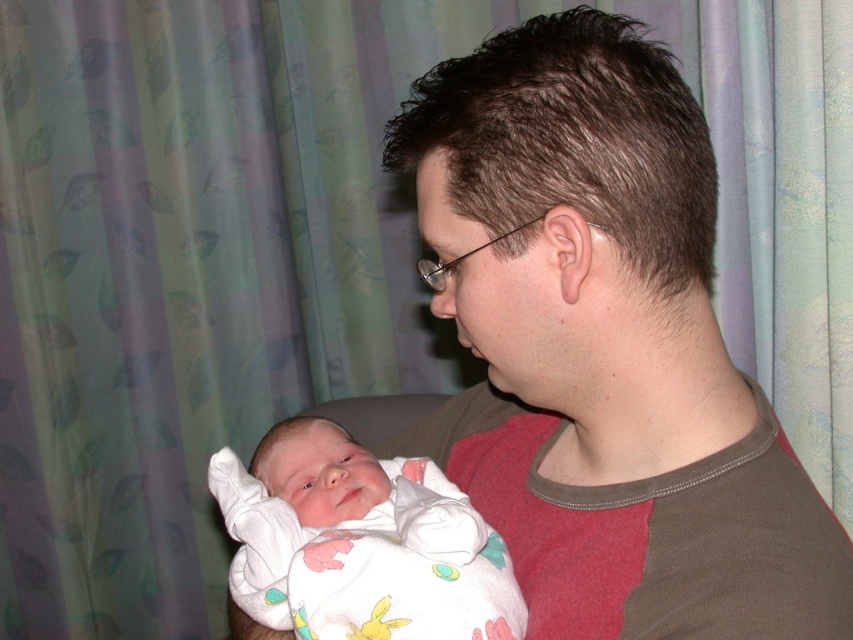
Question: Among these points, which one is farthest from the camera?

Choices:
 (A) coord(440,461)
 (B) coord(257,547)

Answer: (A)

Question: Does brown cotton shirt at center come behind white soft fabric newborn at center?

Choices:
 (A) no
 (B) yes

Answer: (A)

Question: Does brown cotton shirt at center have a larger size compared to white soft fabric newborn at center?

Choices:
 (A) no
 (B) yes

Answer: (B)

Question: Does brown cotton shirt at center have a larger size compared to white soft fabric newborn at center?

Choices:
 (A) yes
 (B) no

Answer: (A)

Question: Which point is farther to the camera?

Choices:
 (A) brown cotton shirt at center
 (B) white soft fabric newborn at center

Answer: (B)